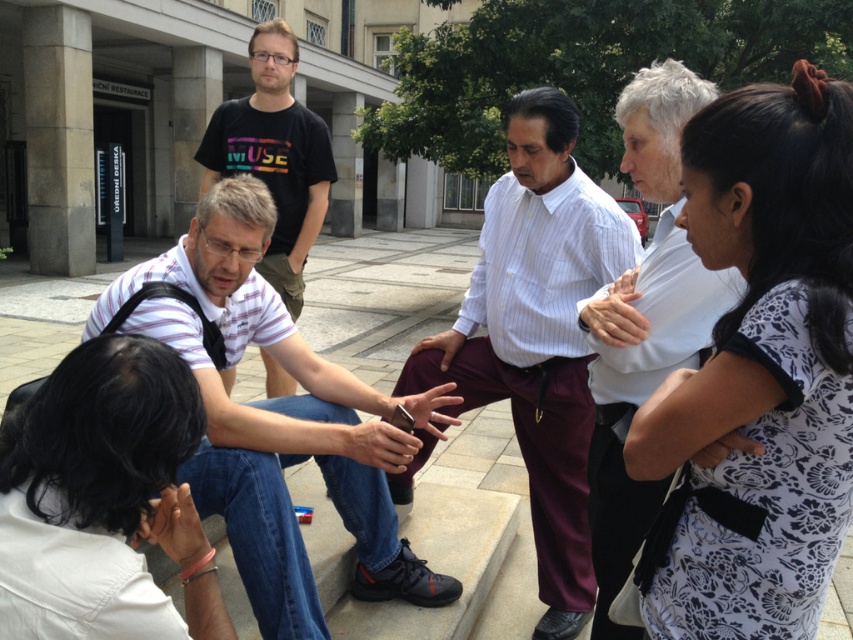
Can you confirm if white striped shirt at center is smaller than white shirt at upper center?

No.

Does white striped shirt at center appear on the left side of white shirt at upper center?

Correct, you'll find white striped shirt at center to the left of white shirt at upper center.

Is point (503, 289) positioned behind point (606, 499)?

Yes, point (503, 289) is behind point (606, 499).

The height and width of the screenshot is (640, 853). Identify the location of white striped shirt at center. (538, 333).

Is point (653, 198) closer to viewer compared to point (177, 536)?

No.

Which is above, white shirt at upper center or dark skin hand at lower left?

Positioned higher is white shirt at upper center.

I want to click on white shirt at upper center, so click(643, 324).

Can you confirm if matte black t-shirt at center is taller than smooth leather handbag at center?

Correct, matte black t-shirt at center is much taller as smooth leather handbag at center.

Looking at this image, is matte black t-shirt at center smaller than smooth leather handbag at center?

Actually, matte black t-shirt at center might be larger than smooth leather handbag at center.

This screenshot has width=853, height=640. In order to click on matte black t-shirt at center in this screenshot , I will do `click(274, 156)`.